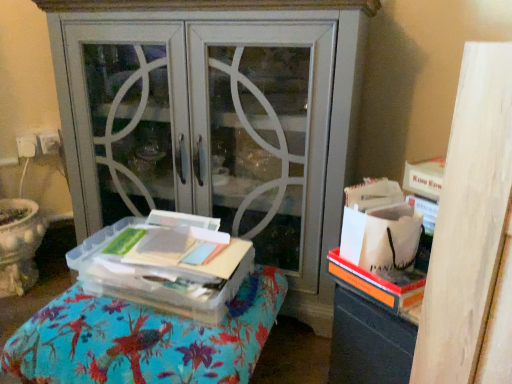
Question: Is matte gray cabinet at center bigger than clear plastic container at center?

Choices:
 (A) yes
 (B) no

Answer: (A)

Question: Is matte gray cabinet at center aimed at clear plastic container at center?

Choices:
 (A) yes
 (B) no

Answer: (A)

Question: From the image's perspective, is matte gray cabinet at center on top of clear plastic container at center?

Choices:
 (A) no
 (B) yes

Answer: (B)

Question: Is matte gray cabinet at center shorter than clear plastic container at center?

Choices:
 (A) no
 (B) yes

Answer: (A)

Question: Does matte gray cabinet at center appear on the left side of clear plastic container at center?

Choices:
 (A) yes
 (B) no

Answer: (B)

Question: Is point (295, 165) closer or farther from the camera than point (118, 382)?

Choices:
 (A) farther
 (B) closer

Answer: (A)

Question: From a real-world perspective, is matte gray cabinet at center above or below clear plastic container at center?

Choices:
 (A) below
 (B) above

Answer: (B)

Question: Is matte gray cabinet at center spatially inside clear plastic container at center, or outside of it?

Choices:
 (A) outside
 (B) inside

Answer: (A)

Question: From their relative heights in the image, would you say matte gray cabinet at center is taller or shorter than clear plastic container at center?

Choices:
 (A) short
 (B) tall

Answer: (B)

Question: Considering the positions of matte gray cabinet at center and clear plastic container at center in the image, is matte gray cabinet at center bigger or smaller than clear plastic container at center?

Choices:
 (A) small
 (B) big

Answer: (B)

Question: Is point (318, 147) positioned closer to the camera than point (176, 294)?

Choices:
 (A) farther
 (B) closer

Answer: (A)

Question: From a real-world perspective, is matte gray cabinet at center physically located above or below clear plastic container at center?

Choices:
 (A) above
 (B) below

Answer: (A)

Question: Would you say matte gray cabinet at center is to the left or to the right of clear plastic container at center in the picture?

Choices:
 (A) right
 (B) left

Answer: (A)

Question: From their relative heights in the image, would you say clear plastic container at center is taller or shorter than matte gray cabinet at center?

Choices:
 (A) short
 (B) tall

Answer: (A)

Question: Would you say clear plastic container at center is to the left or to the right of matte gray cabinet at center in the picture?

Choices:
 (A) left
 (B) right

Answer: (A)